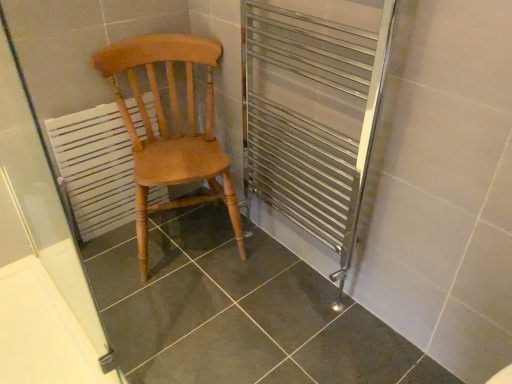
Question: From a real-world perspective, is white painted wood radiator at left above or below white matte screen door at left?

Choices:
 (A) below
 (B) above

Answer: (A)

Question: Is white painted wood radiator at left wider or thinner than white matte screen door at left?

Choices:
 (A) thin
 (B) wide

Answer: (B)

Question: Which is farther from the white painted wood radiator at left?

Choices:
 (A) light brown wood chair at center
 (B) white matte screen door at left

Answer: (A)

Question: Based on their relative distances, which object is nearer to the light brown wood chair at center?

Choices:
 (A) white matte screen door at left
 (B) white painted wood radiator at left

Answer: (B)